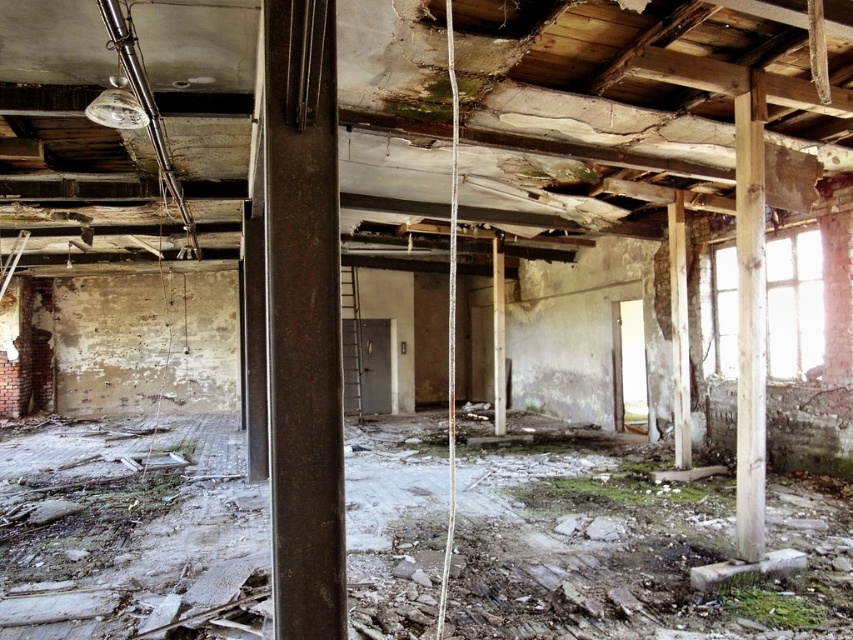
Who is lower down, smooth concrete pillar at center or wooden beam at center?

wooden beam at center

Which is behind, point (672, 241) or point (502, 275)?

The point (502, 275) is behind.

Describe the element at coordinates (679, 332) in the screenshot. I see `smooth concrete pillar at center` at that location.

You are a GUI agent. You are given a task and a screenshot of the screen. Output one action in this format:
    pyautogui.click(x=<x>, y=<y>)
    Task: Click on the smooth concrete pillar at center
    This screenshot has height=640, width=853.
    Given the screenshot: What is the action you would take?
    pyautogui.click(x=679, y=332)

Who is lower down, rusty metal beam at center or wooden post at right?

rusty metal beam at center is below.

Describe the element at coordinates (303, 320) in the screenshot. I see `rusty metal beam at center` at that location.

Is point (296, 189) less distant than point (755, 259)?

Yes.

I want to click on rusty metal beam at center, so click(303, 320).

Does rusty metal beam at center come in front of smooth concrete pillar at center?

Yes, it is in front of smooth concrete pillar at center.

This screenshot has width=853, height=640. What are the coordinates of `rusty metal beam at center` in the screenshot? It's located at (303, 320).

Where is `rusty metal beam at center`? This screenshot has width=853, height=640. rusty metal beam at center is located at coordinates (303, 320).

What are the coordinates of `rusty metal beam at center` in the screenshot? It's located at (303, 320).